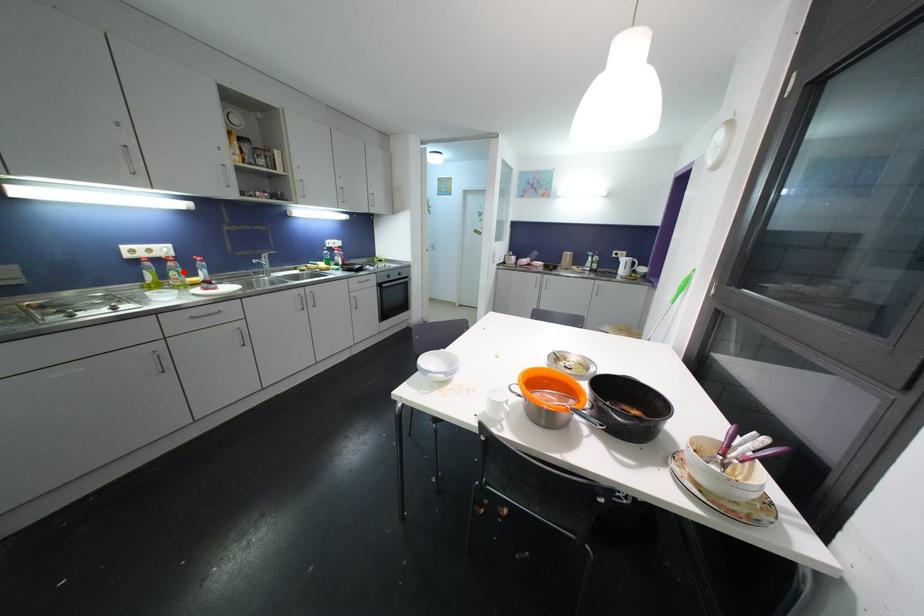
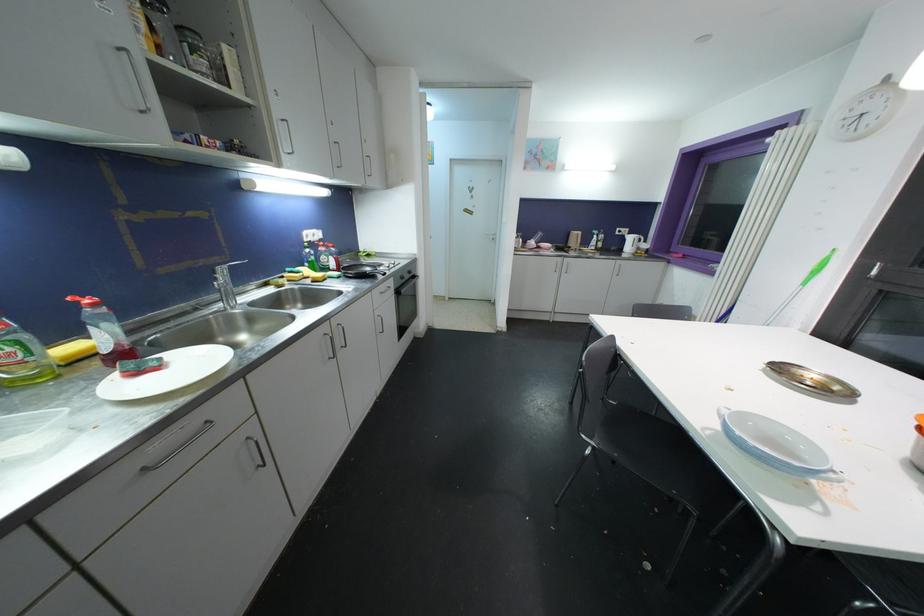
Where in the second image is the point corresponding to the highlighted location from the first image?

(27, 339)